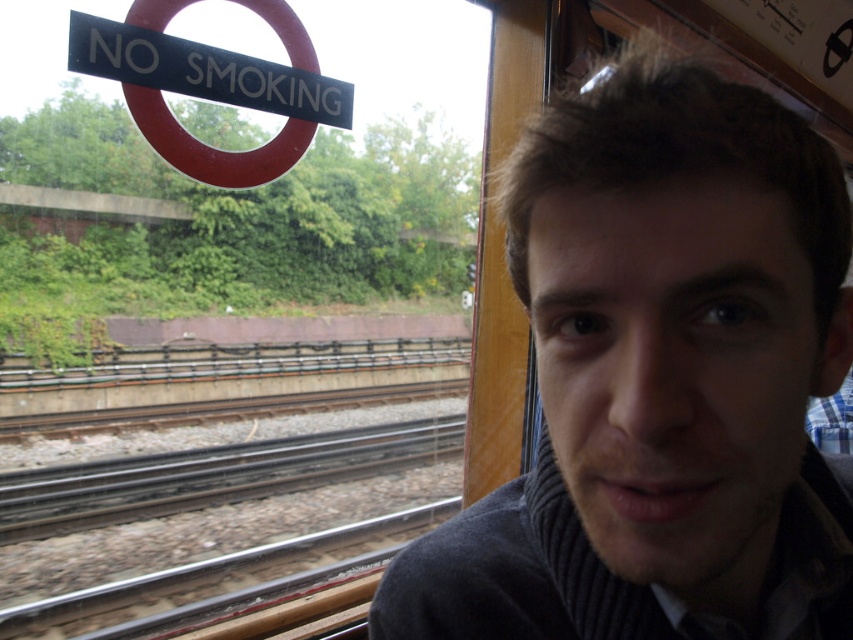
Is point (482, 561) in front of point (119, 49)?

Yes.

Is gray ribbed sweater at right to the left of black plastic sign at upper left from the viewer's perspective?

In fact, gray ribbed sweater at right is to the right of black plastic sign at upper left.

Between point (714, 310) and point (103, 19), which one is positioned behind?

The point (103, 19) is behind.

Locate an element on the screen. The height and width of the screenshot is (640, 853). gray ribbed sweater at right is located at coordinates (660, 380).

Who is more distant from viewer, (73, 301) or (238, 77)?

Positioned behind is point (73, 301).

Which is more to the right, transparent glass at center or black plastic sign at upper left?

black plastic sign at upper left

This screenshot has height=640, width=853. Find the location of `transparent glass at center`. transparent glass at center is located at coordinates (264, 280).

Can you confirm if gray ribbed sweater at right is shorter than transparent glass at center?

Yes.

Locate an element on the screen. The height and width of the screenshot is (640, 853). gray ribbed sweater at right is located at coordinates (660, 380).